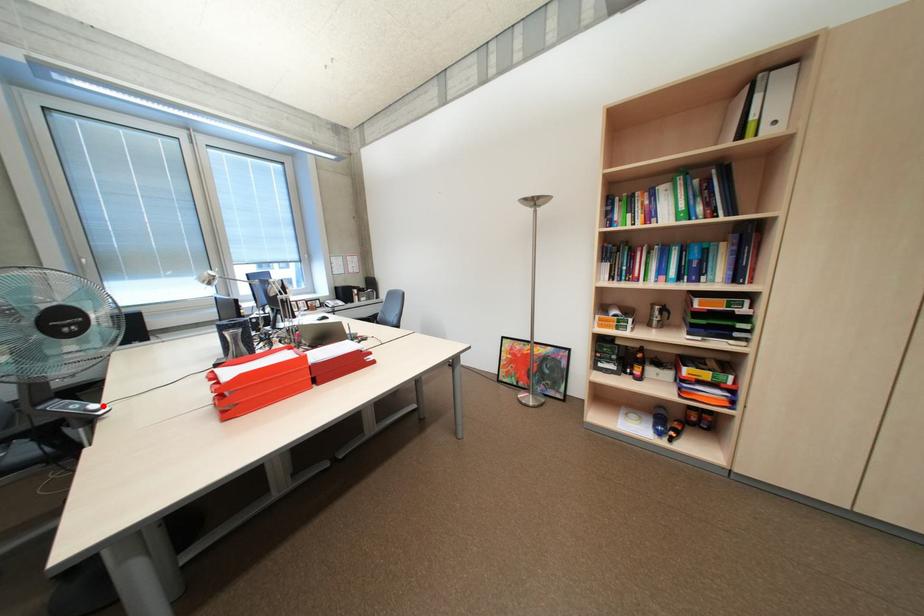
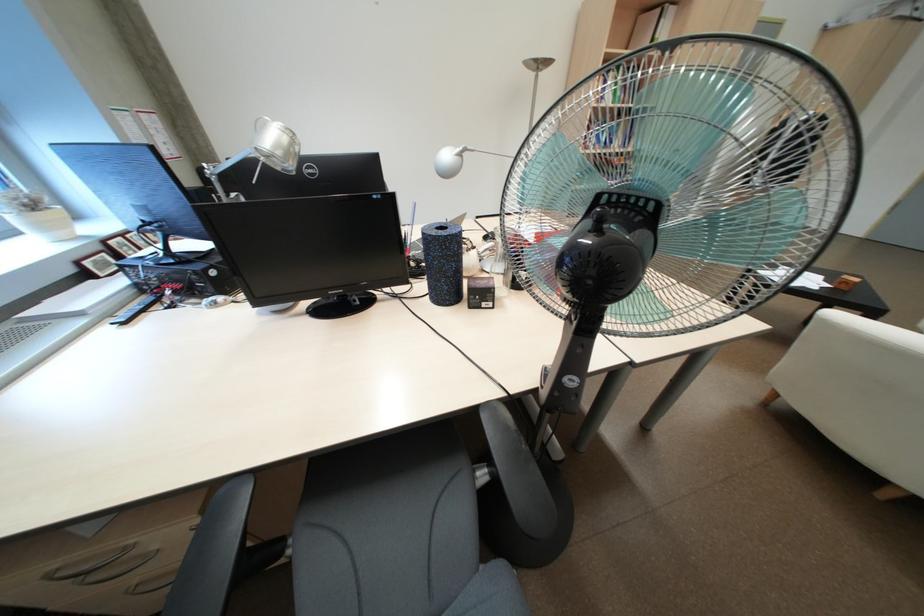
Question: I am providing you with two images of the same scene from different viewpoints. A red point is marked on the first image. Is the red point's position out of view in image 2?

Choices:
 (A) Yes
 (B) No

Answer: (A)